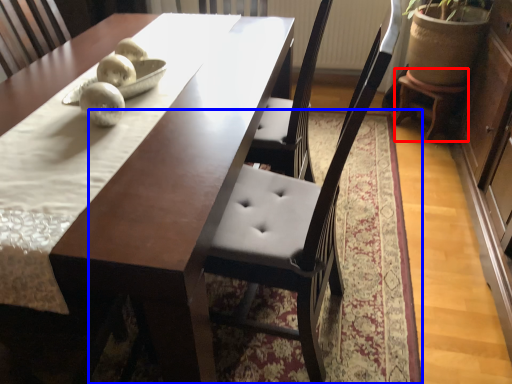
Question: Which of the following is the closest to the observer, stool (highlighted by a red box) or mat (highlighted by a blue box)?

Choices:
 (A) stool
 (B) mat

Answer: (B)